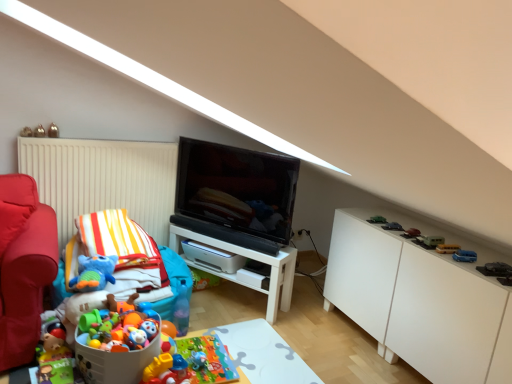
I want to click on free space in front of yellow matte school bus at right, the 7th toy viewed from the top, so click(x=460, y=258).